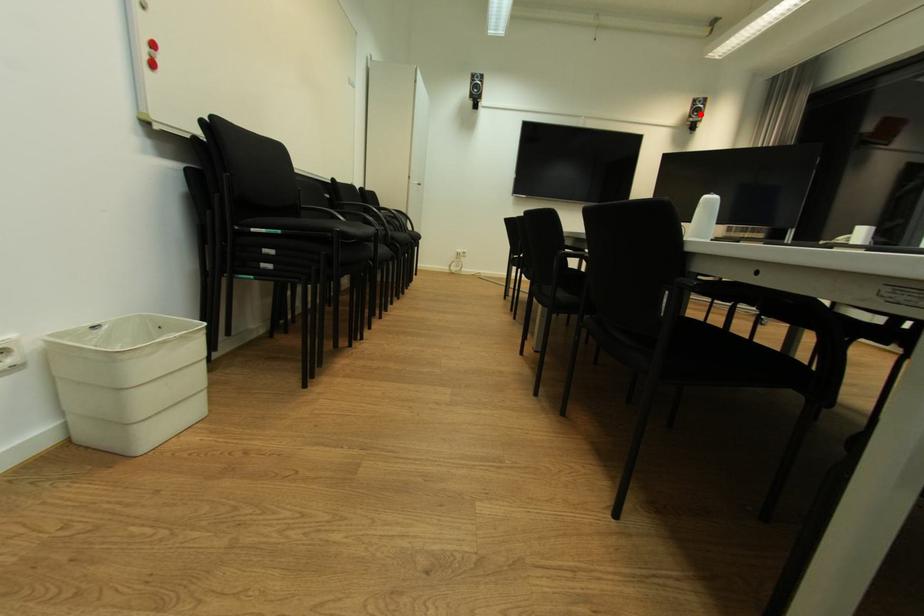
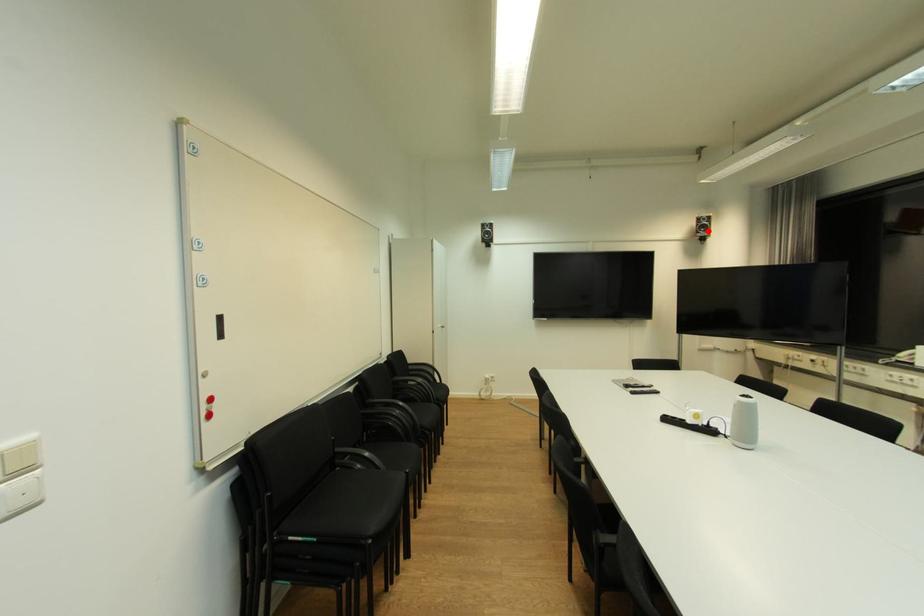
I am providing you with two images of the same scene from different viewpoints. A red point is marked on the first image and another point is marked on the second image. Is the red point in image1 aligned with the point shown in image2?

Yes